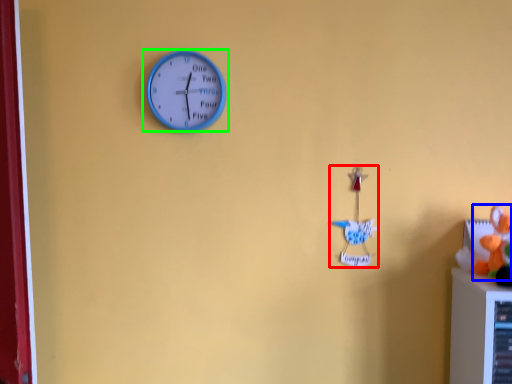
Question: Based on their relative distances, which object is farther from toy (highlighted by a red box)? Choose from toy (highlighted by a blue box) and wall clock (highlighted by a green box).

Choices:
 (A) toy
 (B) wall clock

Answer: (B)